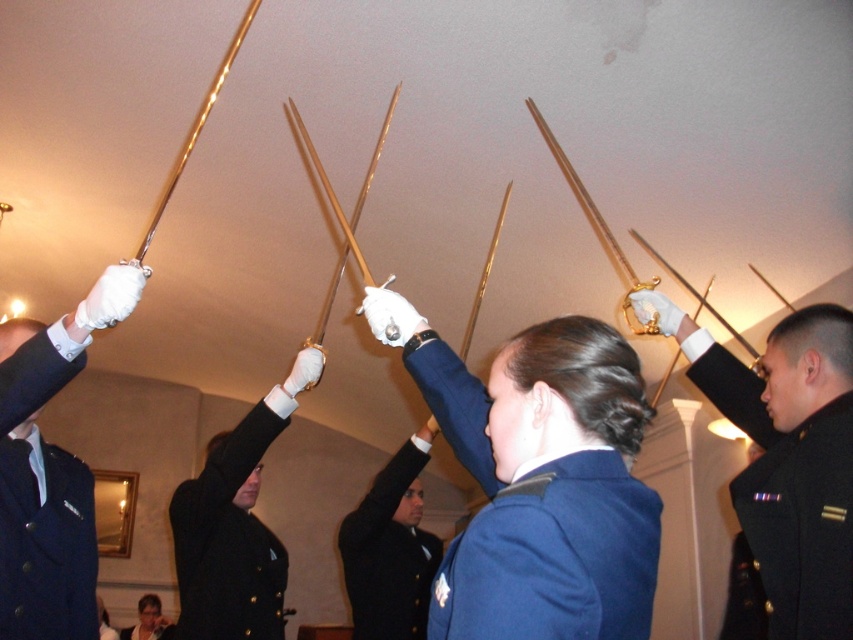
Question: Where is navy blue wool jacket at upper left located in relation to gold polished sword at upper right in the image?

Choices:
 (A) left
 (B) right

Answer: (A)

Question: Which object is the farthest from the navy blue wool jacket at upper left?

Choices:
 (A) gold polished sword at center
 (B) blue woolen blazer at upper center
 (C) blue fabric uniform at center

Answer: (B)

Question: Among these objects, which one is farthest from the camera?

Choices:
 (A) gold polished sword at center
 (B) blue woolen blazer at upper center
 (C) blue fabric uniform at center
 (D) gold polished sword at upper right

Answer: (B)

Question: Does black wool jacket at upper center appear over matte black hair at upper center?

Choices:
 (A) no
 (B) yes

Answer: (B)

Question: Which point appears farthest from the camera in this image?

Choices:
 (A) (476, 392)
 (B) (0, 547)
 (C) (360, 196)

Answer: (C)

Question: Can you confirm if gold polished sword at center is thinner than matte black hair at upper center?

Choices:
 (A) no
 (B) yes

Answer: (B)